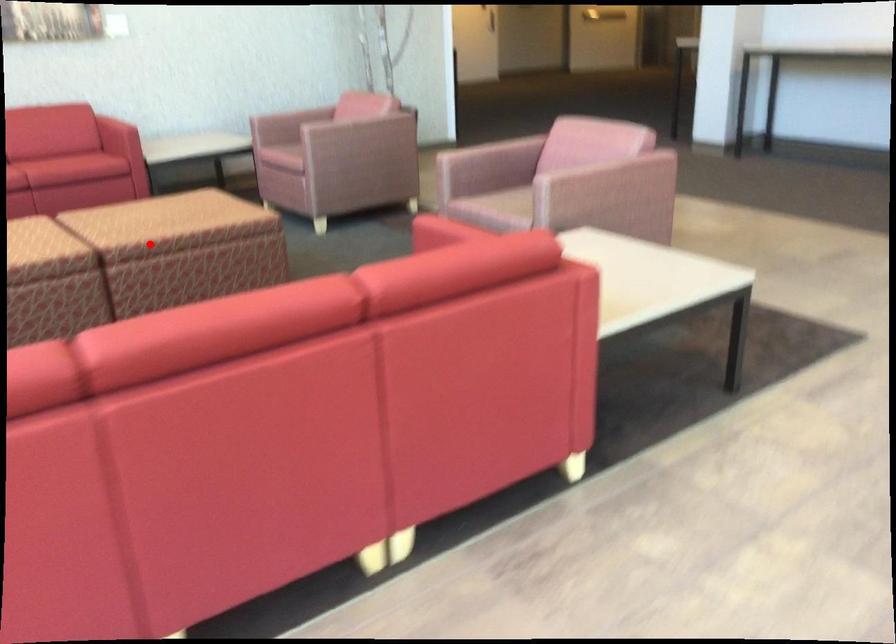
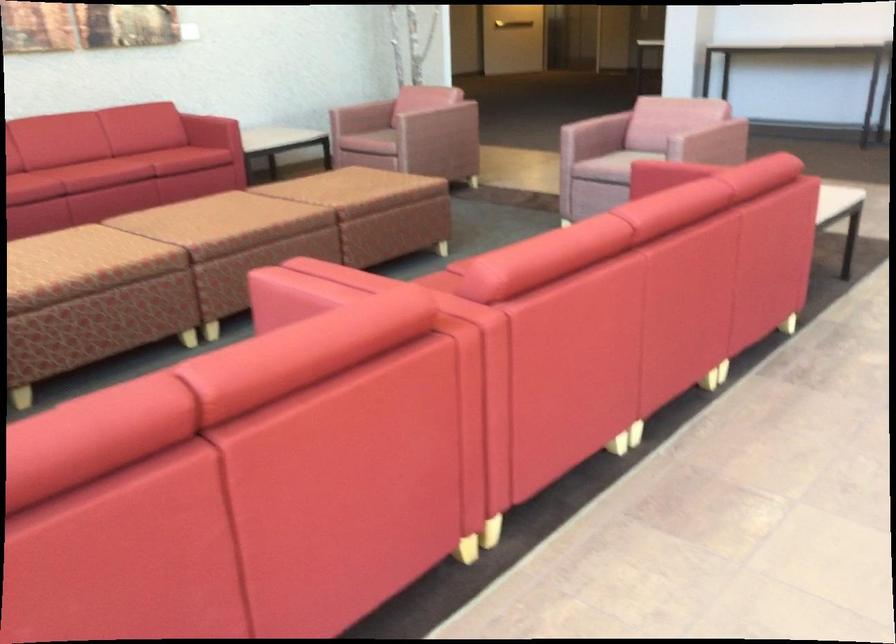
Question: I am providing you with two images of the same scene from different viewpoints. Image1 has a red point marked. In image2, the corresponding 3D location appears at what relative position? Reply with the corresponding letter.

Choices:
 (A) Closer
 (B) Farther

Answer: (B)